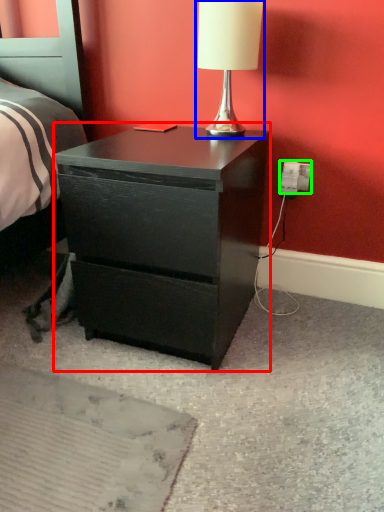
Question: Based on their relative distances, which object is farther from nightstand (highlighted by a red box)? Choose from table lamp (highlighted by a blue box) and electric outlet (highlighted by a green box).

Choices:
 (A) table lamp
 (B) electric outlet

Answer: (B)